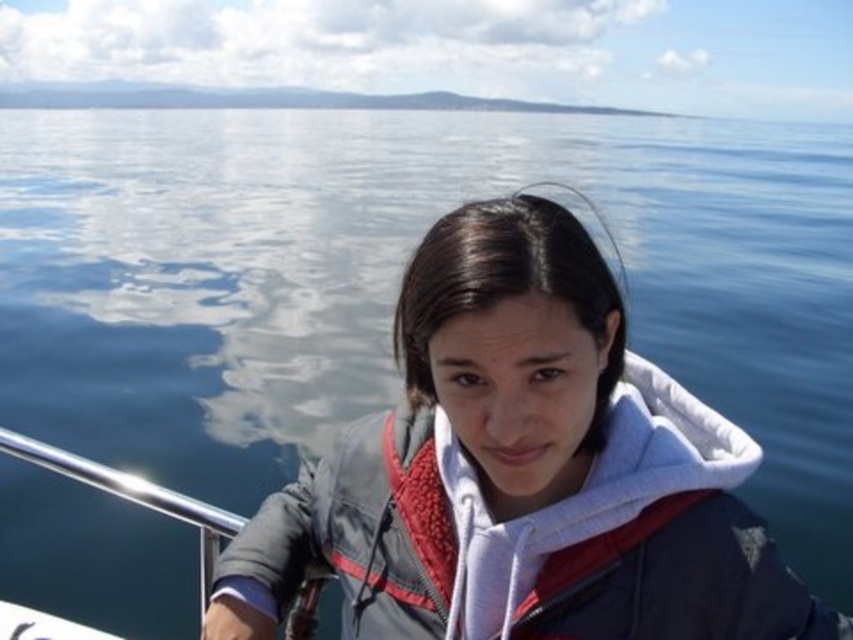
Question: Does white fleece jacket at center have a greater width compared to polished metal rail at lower left?

Choices:
 (A) yes
 (B) no

Answer: (A)

Question: Which point appears farthest from the camera in this image?

Choices:
 (A) (303, 604)
 (B) (730, 572)

Answer: (A)

Question: Considering the relative positions of white fleece jacket at center and polished metal rail at lower left in the image provided, where is white fleece jacket at center located with respect to polished metal rail at lower left?

Choices:
 (A) left
 (B) right

Answer: (B)

Question: Which object appears farthest from the camera in this image?

Choices:
 (A) white fleece jacket at center
 (B) polished metal rail at lower left

Answer: (B)

Question: Where is white fleece jacket at center located in relation to polished metal rail at lower left in the image?

Choices:
 (A) left
 (B) right

Answer: (B)